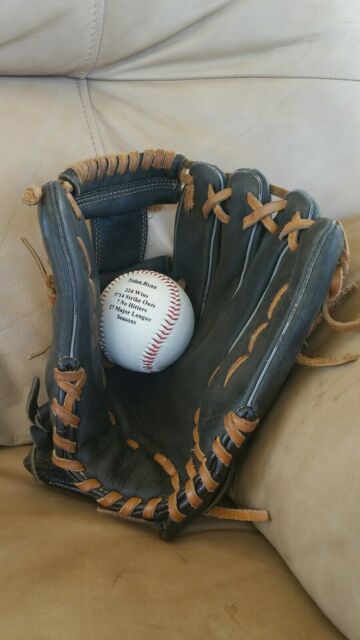
You are a GUI agent. You are given a task and a screenshot of the screen. Output one action in this format:
    pyautogui.click(x=<x>, y=<y>)
    Task: Click on the tuft in material
    
    Given the screenshot: What is the action you would take?
    pyautogui.click(x=80, y=80)